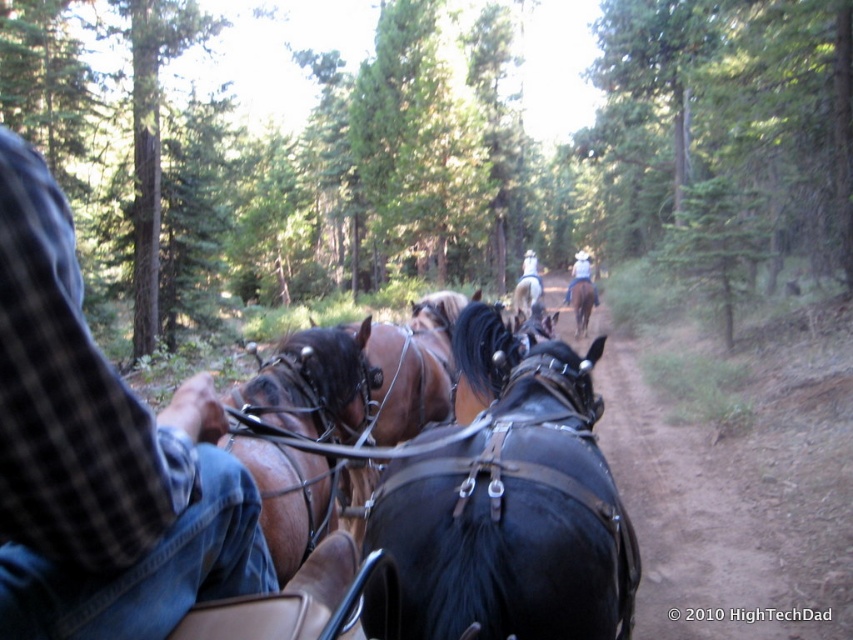
You are standing at the point with coordinates (526, 298) in the forest. What is the nearest object to you?

The nearest object to you at point (526, 298) is the shiny brown horse at center.

You are standing at the camera position and want to reach the point marked as point (250,464). If your walking speed is 3 feet per second, how long will it take you to reach that point?

The distance between you and point (250,464) is 8.62 feet. At a speed of 3 feet per second, it will take approximately 2.87 seconds to reach the point.